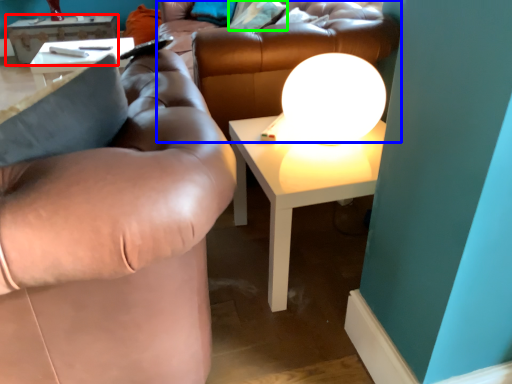
Question: Based on their relative distances, which object is nearer to table (highlighted by a red box)? Choose from couch (highlighted by a blue box) and pillow (highlighted by a green box).

Choices:
 (A) couch
 (B) pillow

Answer: (B)